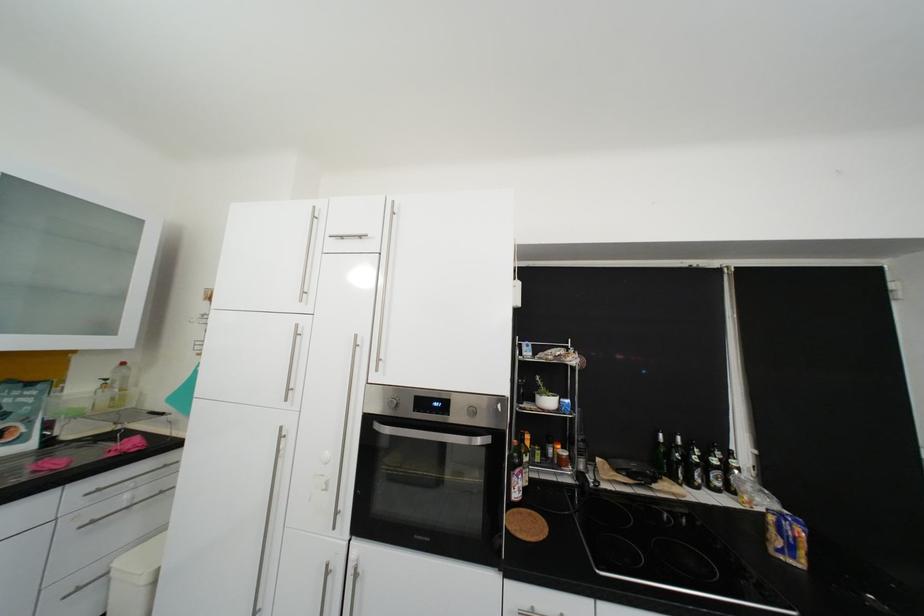
Find the location of `clear plastic bottle`. clear plastic bottle is located at coordinates (119, 383).